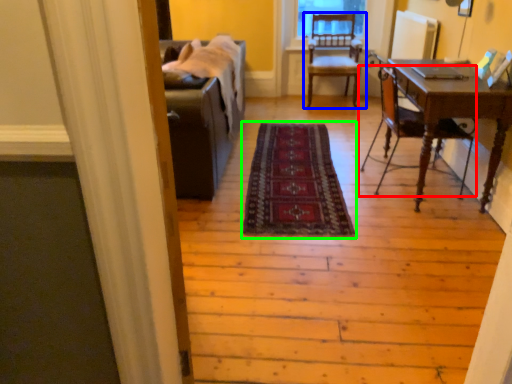
Question: Which is farther away from chair (highlighted by a red box)? chair (highlighted by a blue box) or mat (highlighted by a green box)?

Choices:
 (A) chair
 (B) mat

Answer: (A)